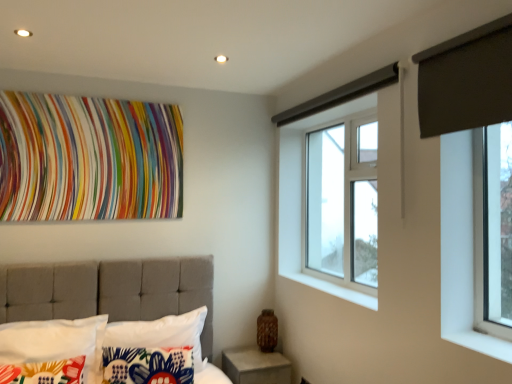
Question: From the image's perspective, is dark gray fabric at upper right on top of concrete at lower right?

Choices:
 (A) yes
 (B) no

Answer: (A)

Question: From the image's perspective, is dark gray fabric at upper right beneath concrete at lower right?

Choices:
 (A) yes
 (B) no

Answer: (B)

Question: From a real-world perspective, does dark gray fabric at upper right sit lower than concrete at lower right?

Choices:
 (A) yes
 (B) no

Answer: (B)

Question: Does dark gray fabric at upper right have a greater width compared to concrete at lower right?

Choices:
 (A) yes
 (B) no

Answer: (B)

Question: Is dark gray fabric at upper right bigger than concrete at lower right?

Choices:
 (A) no
 (B) yes

Answer: (A)

Question: Is dark gray fabric at upper right turned away from concrete at lower right?

Choices:
 (A) yes
 (B) no

Answer: (B)

Question: Is multicolored fabric at upper center beside white fabric pillow at lower left, the first pillow from the right?

Choices:
 (A) no
 (B) yes

Answer: (A)

Question: From a real-world perspective, is multicolored fabric at upper center located beneath white fabric pillow at lower left, arranged as the 3th pillow when viewed from the left?

Choices:
 (A) no
 (B) yes

Answer: (A)

Question: Does multicolored fabric at upper center turn towards white fabric pillow at lower left, arranged as the 3th pillow when viewed from the left?

Choices:
 (A) no
 (B) yes

Answer: (A)

Question: Can you confirm if multicolored fabric at upper center is smaller than white fabric pillow at lower left, the first pillow from the right?

Choices:
 (A) no
 (B) yes

Answer: (B)

Question: Is multicolored fabric at upper center behind white fabric pillow at lower left, the first pillow from the right?

Choices:
 (A) no
 (B) yes

Answer: (B)

Question: Does multicolored fabric at upper center have a lesser width compared to white fabric pillow at lower left, the first pillow from the right?

Choices:
 (A) no
 (B) yes

Answer: (B)

Question: Is white fabric pillow at lower left, the first pillow from the right, positioned with its back to dark gray fabric at upper right?

Choices:
 (A) no
 (B) yes

Answer: (A)